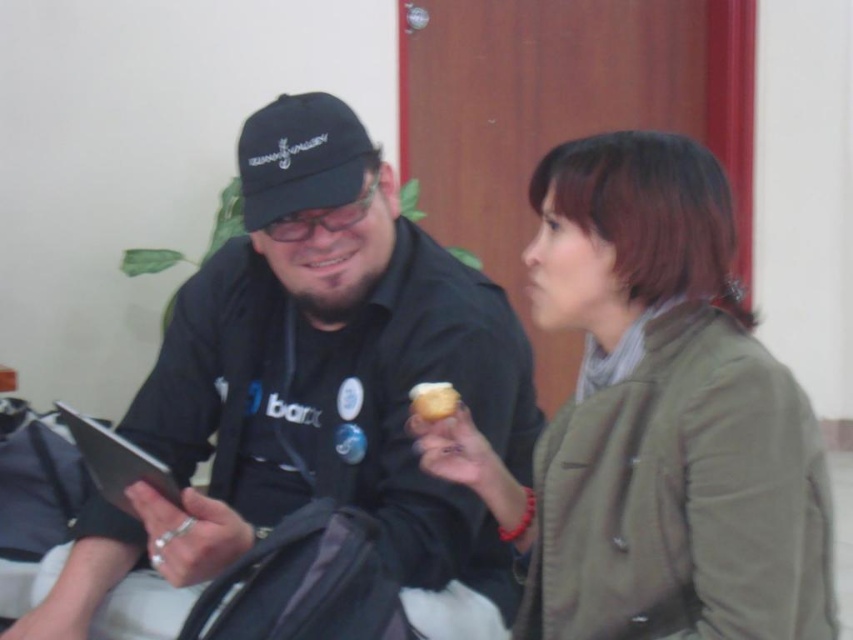
Question: Which of the following is the closest to the observer?

Choices:
 (A) (434, 416)
 (B) (802, 528)
 (C) (306, 124)
 (D) (297, 474)

Answer: (B)

Question: Is black matte shirt at center wider than olive-green fabric jacket at upper right?

Choices:
 (A) no
 (B) yes

Answer: (B)

Question: Observing the image, what is the correct spatial positioning of black matte shirt at center in reference to golden textured ice cream at center?

Choices:
 (A) left
 (B) right

Answer: (A)

Question: Which point is closer to the camera?

Choices:
 (A) black fabric baseball cap at upper center
 (B) golden textured ice cream at center
 (C) olive-green fabric jacket at upper right
 (D) black matte shirt at center

Answer: (C)

Question: Among these objects, which one is nearest to the camera?

Choices:
 (A) olive-green fabric jacket at upper right
 (B) golden textured ice cream at center
 (C) black fabric baseball cap at upper center
 (D) black matte shirt at center

Answer: (A)

Question: Is black matte shirt at center closer to the viewer compared to olive-green fabric jacket at upper right?

Choices:
 (A) yes
 (B) no

Answer: (B)